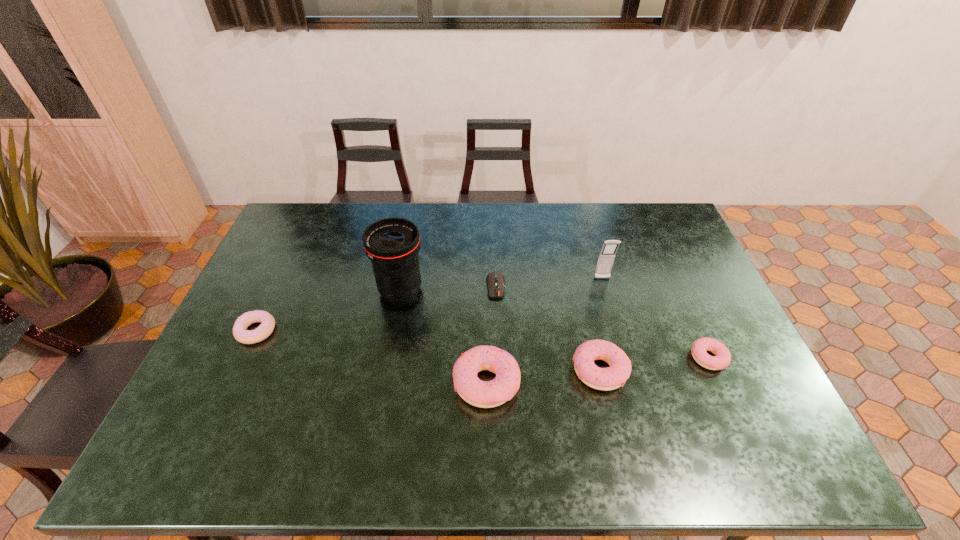
Given the evenly spaced doughnuts in the image, where should an extra doughnut be added on the left to preserve the spacing? Please point to a vacant space. Please provide its 2D coordinates. Your answer should be formatted as a tuple, i.e. [(x, y)], where the tuple contains the x and y coordinates of a point satisfying the conditions above.

[(367, 397)]